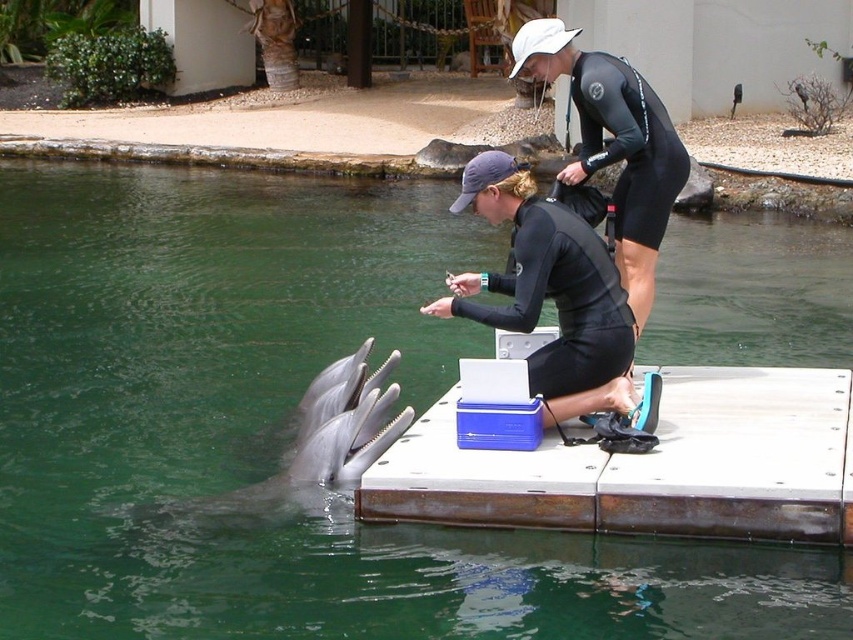
You are a marine biologist observing the scene. You need to determine which object is wider between the black matte wetsuit at center and the gray smooth dolphin at lower left. Based on the scene, what is your conclusion?

The black matte wetsuit at center has a lesser width compared to the gray smooth dolphin at lower left, so the gray smooth dolphin at lower left is wider.

You are a marine biologist observing the scene. You need to determine the position of the white wood dock at center relative to the gray smooth dolphin at lower left. Based on the scene, can you tell if the dock is above or below the dolphin?

The white wood dock at center is above the gray smooth dolphin at lower left according to the description.